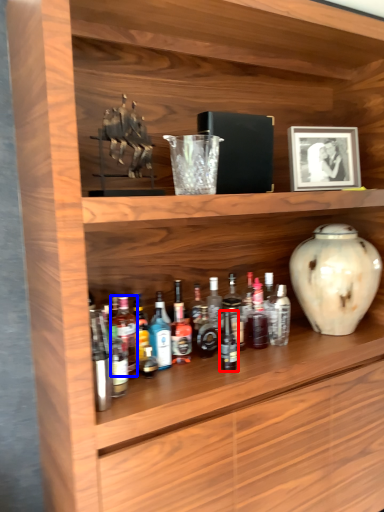
Question: Which object is further to the camera taking this photo, bottle (highlighted by a red box) or bottle (highlighted by a blue box)?

Choices:
 (A) bottle
 (B) bottle

Answer: (A)